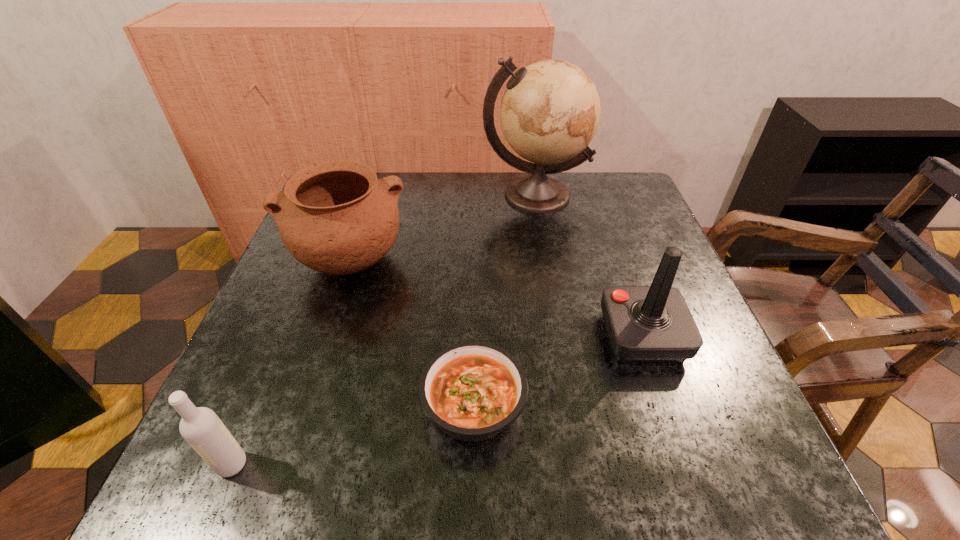
In the image, there is a desktop. Where is `vacant region at the far edge`? vacant region at the far edge is located at coordinates [465, 181].

Identify the location of vacant space at the near edge of the desktop. (412, 437).

The width and height of the screenshot is (960, 540). Find the location of `free location at the left edge`. free location at the left edge is located at coordinates (347, 292).

Find the location of a particular element. free spot at the far right corner of the desktop is located at coordinates (574, 175).

This screenshot has height=540, width=960. I want to click on vacant space at the near right corner of the desktop, so click(x=671, y=476).

Where is `vacant area that lies between the shortest object and the vodka`? This screenshot has height=540, width=960. vacant area that lies between the shortest object and the vodka is located at coordinates (353, 435).

The height and width of the screenshot is (540, 960). I want to click on unoccupied position between the vodka and the pottery, so click(x=290, y=363).

Where is `free space between the vodka and the stew`? The height and width of the screenshot is (540, 960). free space between the vodka and the stew is located at coordinates (353, 435).

Image resolution: width=960 pixels, height=540 pixels. I want to click on free spot between the vodka and the stew, so click(353, 435).

You are a GUI agent. You are given a task and a screenshot of the screen. Output one action in this format:
    pyautogui.click(x=<x>, y=<y>)
    Task: Click on the unoccupied area between the second farthest object and the vodka
    The image size is (960, 540).
    Given the screenshot: What is the action you would take?
    pyautogui.click(x=290, y=363)